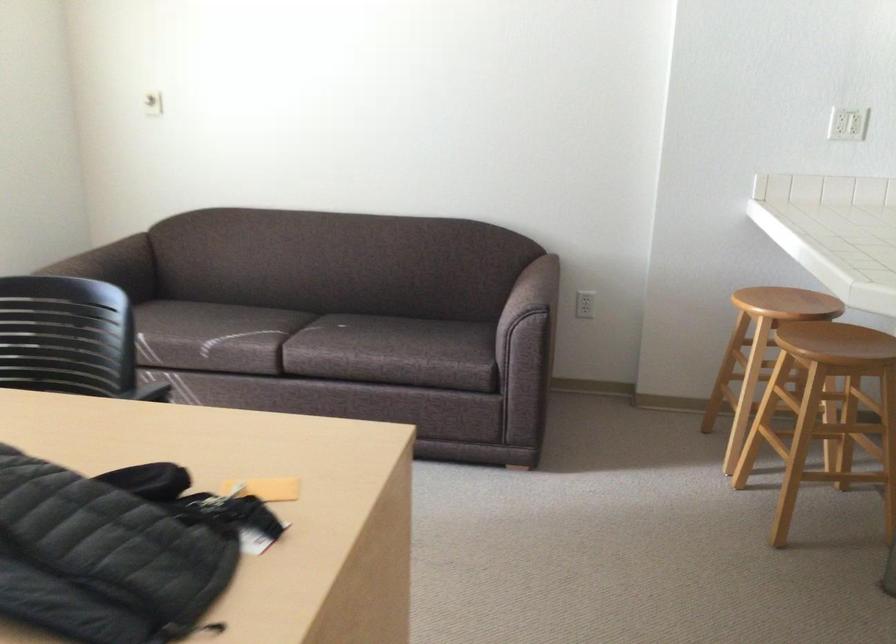
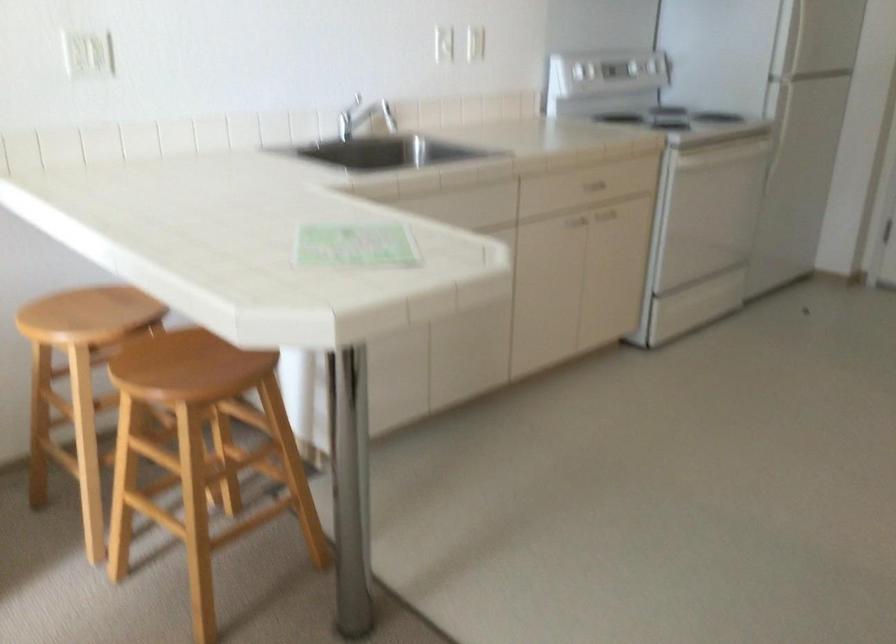
Question: How did the camera likely rotate?

Choices:
 (A) Left
 (B) Right
 (C) Up
 (D) Down

Answer: (B)